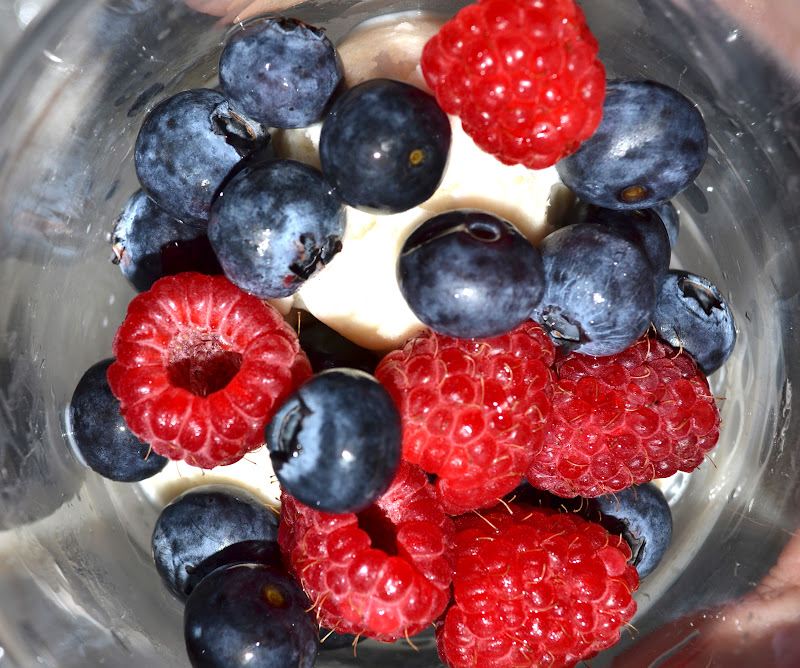
The width and height of the screenshot is (800, 668). Find the location of `translucent glass jar sides`. translucent glass jar sides is located at coordinates (40, 107), (742, 530).